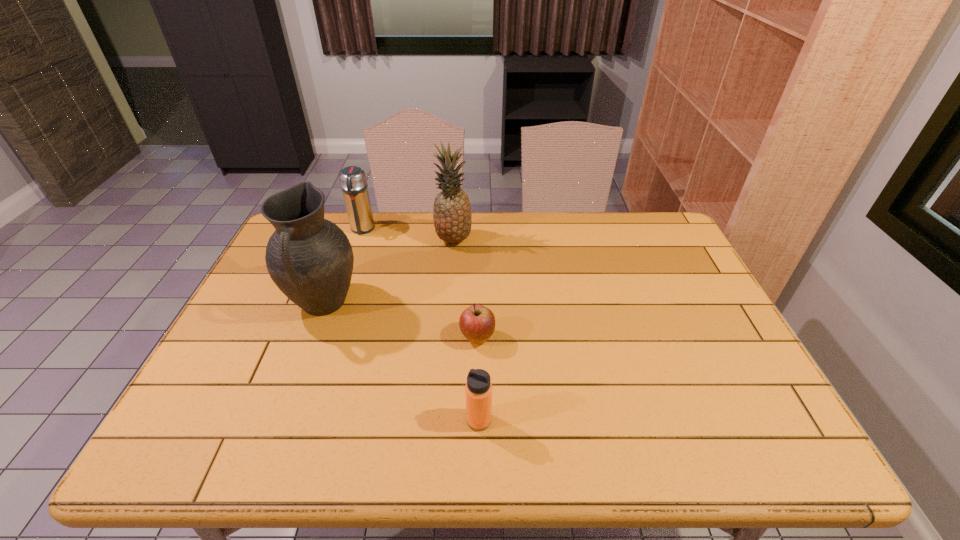
You are a GUI agent. You are given a task and a screenshot of the screen. Output one action in this format:
    pyautogui.click(x=<x>, y=<y>)
    Task: Click on the vacant space located on the left of the right thermos bottle
    
    Given the screenshot: What is the action you would take?
    point(290,420)

Where is `vacant region located 0.320m on the back of the shortest object`? vacant region located 0.320m on the back of the shortest object is located at coordinates (478, 252).

Locate an element on the screen. pineapple present at the far edge is located at coordinates (452, 215).

What are the coordinates of `thermos bottle that is at the far edge` in the screenshot? It's located at (353, 180).

Find the location of a particular element. This screenshot has width=960, height=540. object located in the near edge section of the desktop is located at coordinates (478, 390).

Locate an element on the screen. The image size is (960, 540). object present at the left edge is located at coordinates [x=310, y=259].

Where is `free region at the far edge of the desktop`? This screenshot has width=960, height=540. free region at the far edge of the desktop is located at coordinates (339, 226).

The height and width of the screenshot is (540, 960). What are the coordinates of `free location at the near edge of the desktop` in the screenshot? It's located at (372, 457).

Find the location of a particular element. The image size is (960, 540). vacant space at the left edge is located at coordinates [226, 376].

You are a GUI agent. You are given a task and a screenshot of the screen. Output one action in this format:
    pyautogui.click(x=<x>, y=<y>)
    Task: Click on the free space at the right edge of the desktop
    This screenshot has width=960, height=540.
    Given the screenshot: What is the action you would take?
    pyautogui.click(x=706, y=358)